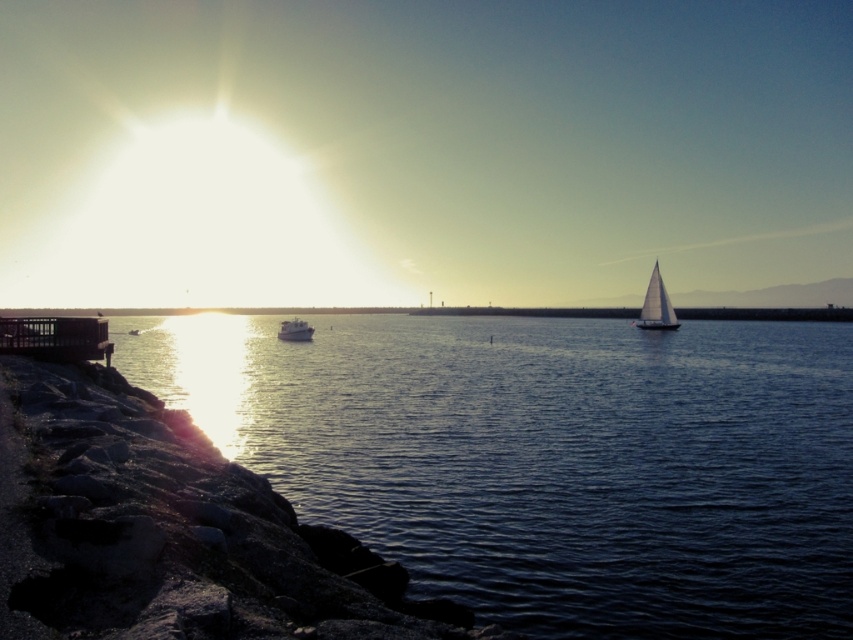
Who is more forward, (665, 296) or (299, 330)?

Point (299, 330) is more forward.

Who is more distant from viewer, [657,304] or [299,321]?

Point [657,304]

Is point (653, 324) positioned behind point (289, 339)?

Yes.

The image size is (853, 640). I want to click on white sailboat at right, so click(656, 305).